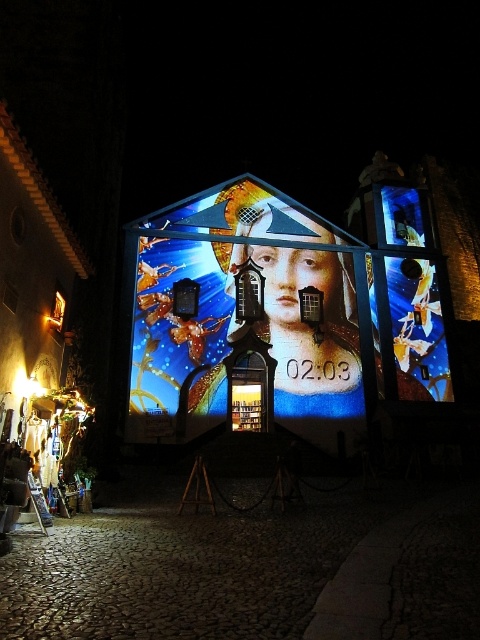
Question: Is shiny metallic billboard at center positioned in front of dark cobblestone alley at center?

Choices:
 (A) yes
 (B) no

Answer: (B)

Question: Is dark cobblestone alley at center wider than matte gold statue at center?

Choices:
 (A) yes
 (B) no

Answer: (A)

Question: Among these points, which one is nearest to the camera?

Choices:
 (A) (444, 500)
 (B) (259, 257)
 (C) (331, 253)

Answer: (A)

Question: Based on their relative distances, which object is nearer to the matte gold statue at center?

Choices:
 (A) shiny metallic billboard at center
 (B) dark cobblestone alley at center

Answer: (A)

Question: Which of the following is the closest to the observer?

Choices:
 (A) (338, 307)
 (B) (331, 436)
 (C) (361, 515)

Answer: (C)

Question: Is dark cobblestone alley at center smaller than matte gold statue at center?

Choices:
 (A) no
 (B) yes

Answer: (B)